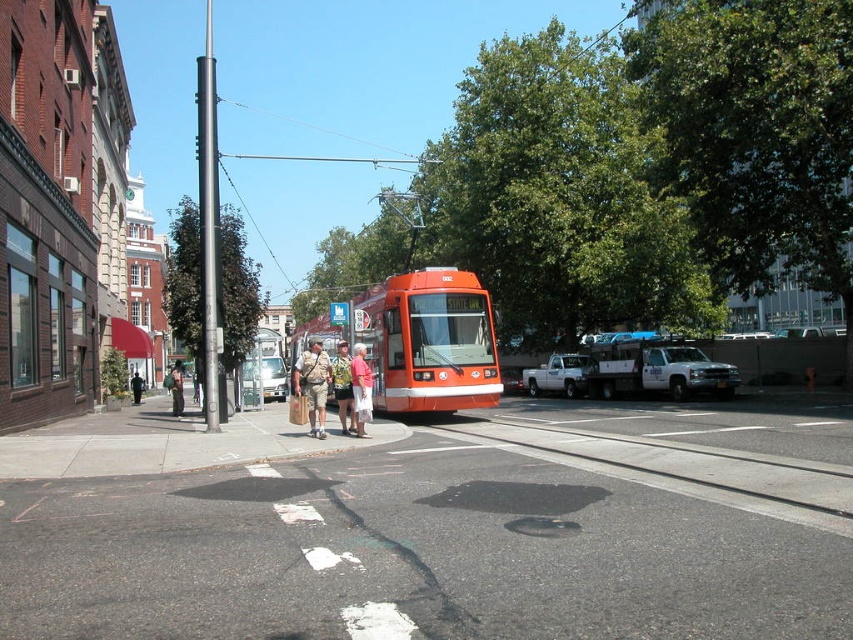
You are a pedestrian standing on the sidewalk to the left of the metallic silver bus at center and the white matte truck at right. You want to cross the street to reach the other side. Which vehicle should you wait behind to ensure you are closest to the curb when crossing?

You should wait behind the metallic silver bus at center because it is in front of the white matte truck at right, making it closer to the curb where you need to cross.

You are standing at point (177, 364) and want to walk to point (561, 394). Given the street layout shown in the image, will you have to cross any obstacles like the streetcar or the sidewalk pedestrians?

Point (561, 394) is in front of point (177, 364). Therefore, walking towards it from your current position, you will not need to cross any obstacles like the streetcar or sidewalk pedestrians since the path is clear.